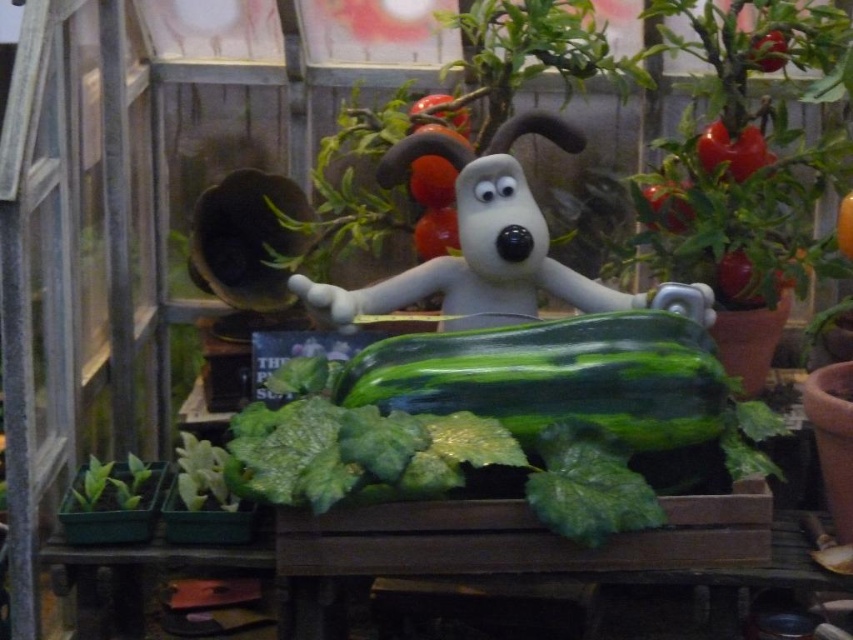
Does white matte dog at center have a greater width compared to green leafy at lower left?

Yes, white matte dog at center is wider than green leafy at lower left.

Which of these two, white matte dog at center or green leafy at lower left, stands taller?

white matte dog at center is taller.

Describe the element at coordinates (489, 244) in the screenshot. I see `white matte dog at center` at that location.

Where is `white matte dog at center`? The width and height of the screenshot is (853, 640). white matte dog at center is located at coordinates (489, 244).

The height and width of the screenshot is (640, 853). I want to click on green matte cucumber at center, so click(555, 376).

Find the location of a particular element. The image size is (853, 640). green matte cucumber at center is located at coordinates (555, 376).

Between green matte cucumber at center and green leafy at lower left, which one appears on the right side from the viewer's perspective?

green matte cucumber at center

Does point (502, 328) come closer to viewer compared to point (184, 465)?

Yes, it is.

The width and height of the screenshot is (853, 640). Find the location of `green matte cucumber at center`. green matte cucumber at center is located at coordinates (555, 376).